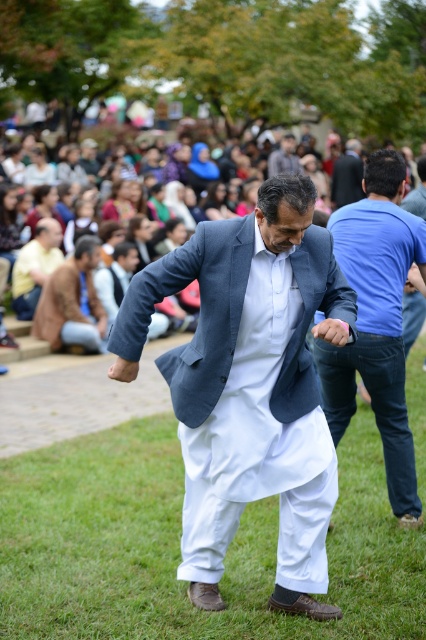
You are a photographer at the event and need to capture a photo of both the brown leather jacket at left and the dark gray suit at upper center in the same frame. Given that your camera has a fixed focal length and limited field of view, which object should you position closer to the center of the frame to ensure both are visible without cropping?

Since the brown leather jacket at left is wider than the dark gray suit at upper center, you should position the brown leather jacket at left closer to the center of the frame. This will help accommodate its larger width within the camera frame while keeping the dark gray suit at upper center also visible.